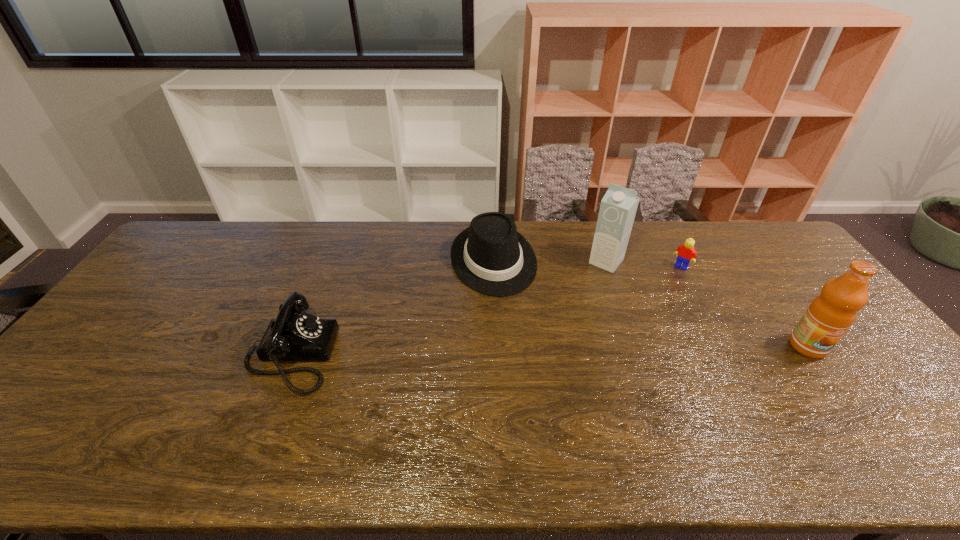
The height and width of the screenshot is (540, 960). Identify the location of object present at the near edge. (294, 335).

You are a GUI agent. You are given a task and a screenshot of the screen. Output one action in this format:
    pyautogui.click(x=<x>, y=<y>)
    Task: Click on the object located at the right edge
    
    Given the screenshot: What is the action you would take?
    pyautogui.click(x=828, y=317)

Locate an element on the screen. vacant point at the far edge is located at coordinates (249, 240).

At what (x,y) coordinates should I click in order to perform the action: click on vacant position at the near edge of the desktop. Please return your answer as a coordinate pair (x, y). Looking at the image, I should click on (560, 417).

In the image, there is a desktop. Where is `vacant space at the left edge`? The image size is (960, 540). vacant space at the left edge is located at coordinates tap(119, 338).

Locate an element on the screen. This screenshot has width=960, height=540. free spot at the far right corner of the desktop is located at coordinates (787, 246).

Locate an element on the screen. The width and height of the screenshot is (960, 540). vacant area at the near right corner is located at coordinates (874, 403).

Where is `free point between the fedora and the carton`? The height and width of the screenshot is (540, 960). free point between the fedora and the carton is located at coordinates (550, 261).

Locate an element on the screen. free area in between the rightmost object and the second object from left to right is located at coordinates (651, 303).

Identify the location of free space between the fruit juice and the third object from right to left. (707, 304).